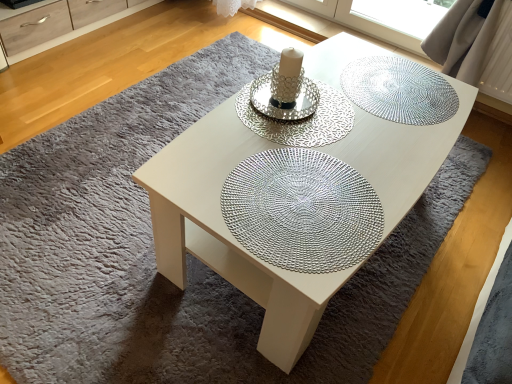
Question: Considering the positions of matte wood dresser at upper left and silver metallic doily at center, the second glass plate when ordered from front to back, in the image, is matte wood dresser at upper left wider or thinner than silver metallic doily at center, the second glass plate when ordered from front to back,?

Choices:
 (A) wide
 (B) thin

Answer: (A)

Question: Is point (82, 31) closer or farther from the camera than point (321, 144)?

Choices:
 (A) closer
 (B) farther

Answer: (B)

Question: Which of these objects is positioned farthest from the white glossy coffee table at center?

Choices:
 (A) matte wood dresser at upper left
 (B) silver metallic doily at center, the 2th glass plate in the back-to-front sequence
 (C) silver textured doily at center, the first glass plate in the front-to-back sequence
 (D) metallic silver doily at upper right, which ranks as the first glass plate in back-to-front order

Answer: (A)

Question: Which object is the farthest from the metallic silver doily at upper right, which ranks as the first glass plate in back-to-front order?

Choices:
 (A) white glossy coffee table at center
 (B) silver textured doily at center, the first glass plate in the front-to-back sequence
 (C) silver metallic doily at center, the 2th glass plate in the back-to-front sequence
 (D) matte wood dresser at upper left

Answer: (D)